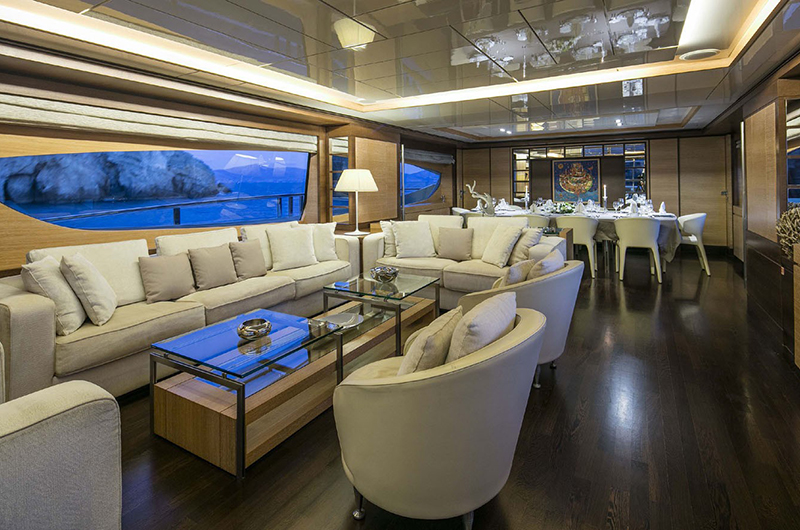
Locate an element on the screen. The height and width of the screenshot is (530, 800). yacht living room is located at coordinates (566, 311).